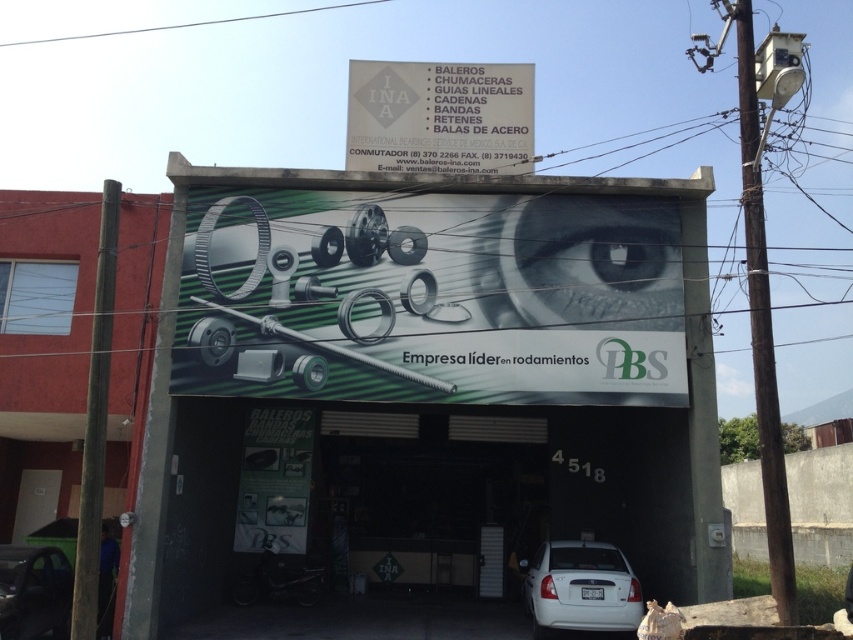
Which of these two, white paper at lower center or white matte car at lower right, stands taller?

white paper at lower center

Can you confirm if white paper at lower center is positioned to the right of white matte car at lower right?

No, white paper at lower center is not to the right of white matte car at lower right.

What are the coordinates of `white paper at lower center` in the screenshot? It's located at (274, 480).

Locate an element on the screen. white paper at lower center is located at coordinates (274, 480).

Is white paper at lower center positioned behind gray matte eye at upper center?

That is True.

Does white paper at lower center have a greater width compared to gray matte eye at upper center?

No, white paper at lower center is not wider than gray matte eye at upper center.

Between point (300, 486) and point (640, 285), which one is positioned in front?

Point (640, 285) is in front.

Locate an element on the screen. This screenshot has height=640, width=853. white paper at lower center is located at coordinates (274, 480).

Which is more to the left, shiny black car at lower left or gray matte eye at upper center?

Result: shiny black car at lower left

Which is in front, point (28, 548) or point (642, 282)?

Point (28, 548) is more forward.

In order to click on shiny black car at lower left in this screenshot , I will do `click(33, 592)`.